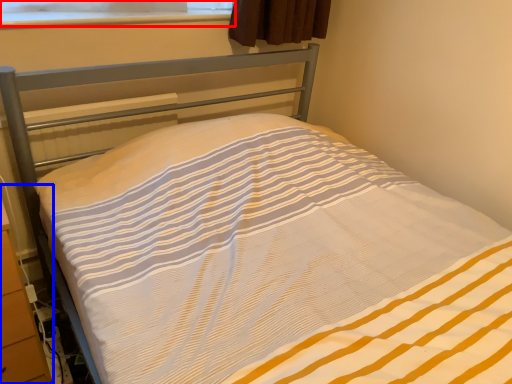
Question: Which of the following is the farthest to the observer, window screen (highlighted by a red box) or dresser (highlighted by a blue box)?

Choices:
 (A) window screen
 (B) dresser

Answer: (A)